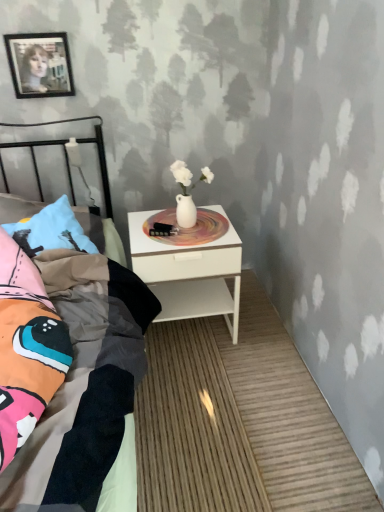
Find the location of a particular element. free space above white glossy nightstand at center (from a real-world perspective) is located at coordinates (176, 223).